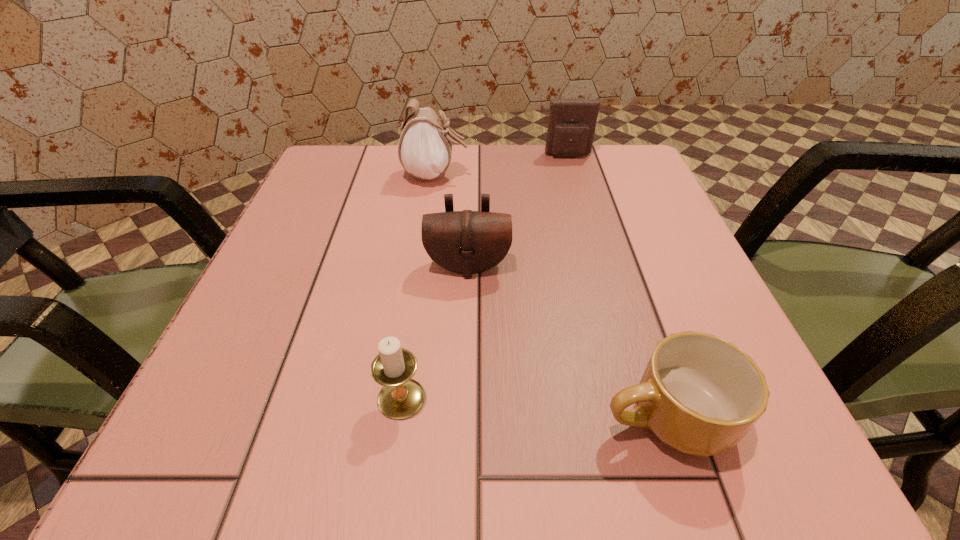
This screenshot has width=960, height=540. What are the coordinates of `free space that satisfies the following two spatial constraints: 1. on the side with the handle of the mug; 2. on the front-facing side of the fourth nearest object` in the screenshot? It's located at (587, 175).

Find the location of a particular element. The width and height of the screenshot is (960, 540). vacant space that satisfies the following two spatial constraints: 1. on the side with the handle of the mug; 2. on the front-facing side of the tallest pouch is located at coordinates (587, 175).

Locate an element on the screen. vacant space that satisfies the following two spatial constraints: 1. on the side with the handle of the mug; 2. with the flap open on the third nearest object is located at coordinates (616, 266).

I want to click on blank space that satisfies the following two spatial constraints: 1. with an open flap on the farthest object; 2. on the side with the handle of the shortest object, so click(x=644, y=417).